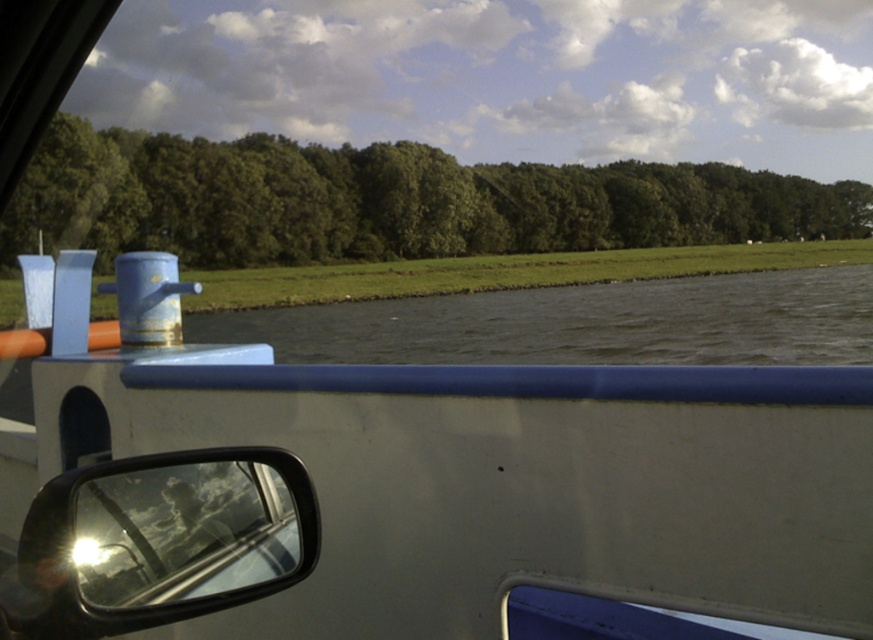
You are a photographer trying to capture the green leafy trees at upper center and the glossy plastic view mirror at lower left in your shot. Which object will appear larger in the photo?

The green leafy trees at upper center will appear larger in the photo because they are described as bigger than the glossy plastic view mirror at lower left.

You are standing inside the boat and want to reach a point that is 1.88 meters away from you. The point is located at coordinates point [665,561]. Can you estimate if you can comfortably reach that point without moving your feet?

The distance of point [665,561] from viewer is 1.88 meters. Since the point is 1.88 meters away, it may be slightly out of comfortable reaching distance for most people without moving your feet.